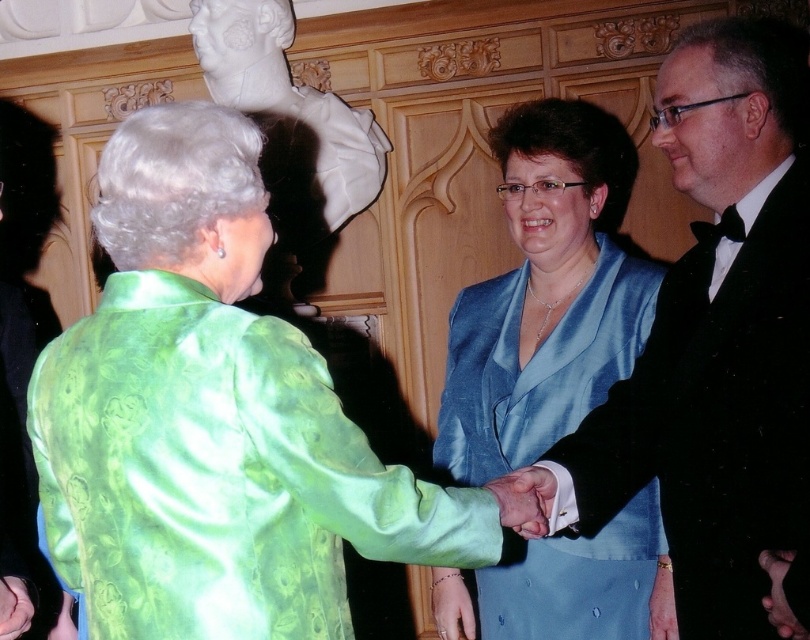
You are an event photographer at this formal event. You need to capture a photo of the black satin tuxedo at right and the smooth skin hand at lower left. Based on their sizes, which one should you zoom in more on to ensure both are clearly visible in the photo?

The black satin tuxedo at right is much taller than the smooth skin hand at lower left, so you should zoom in more on the black satin tuxedo at right to ensure both are clearly visible in the photo.

You are a photographer at the event and need to adjust the lighting to ensure both the green satin blouse at center and the satin blue dress at center are well lit. Given their sizes, which one might require a wider light spread to cover its entirety?

The green satin blouse at center requires a wider light spread because its width is larger than the satin blue dress at center.